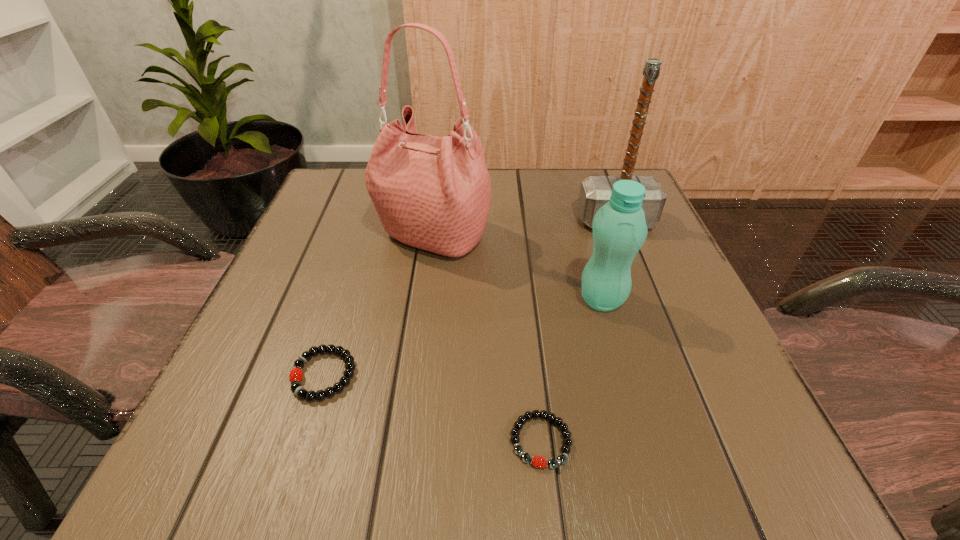
Image resolution: width=960 pixels, height=540 pixels. Identify the location of empty location between the right bracelet and the fourth tallest object. (432, 408).

Locate an element on the screen. blank region between the third shortest object and the nearest object is located at coordinates (571, 370).

The height and width of the screenshot is (540, 960). In order to click on free space that is in between the shortest object and the tallest object in this screenshot , I will do `click(487, 339)`.

What are the coordinates of `free spot between the fourth shortest object and the second shortest object` in the screenshot? It's located at (469, 298).

This screenshot has height=540, width=960. I want to click on object that is the closest to the handbag, so click(x=619, y=227).

In order to click on the third closest object to the fourth shortest object in this screenshot , I will do `click(536, 461)`.

At what (x,y) coordinates should I click in order to perform the action: click on blank space that satisfies the following two spatial constraints: 1. on the back side of the third tallest object; 2. on the right side of the third object from left to right. Please return your answer as a coordinate pair (x, y). Looking at the image, I should click on (525, 299).